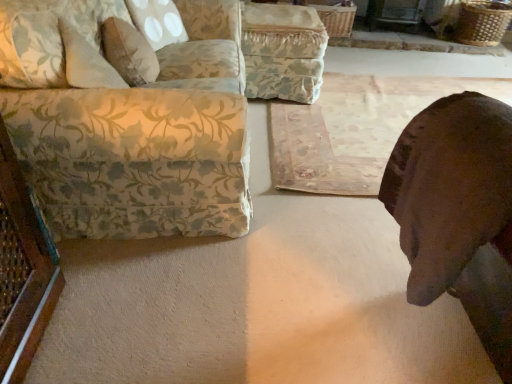
Question: Is brown leather dog at lower right shorter than fluffy beige pillow at upper left?

Choices:
 (A) no
 (B) yes

Answer: (A)

Question: Is brown leather dog at lower right not near fluffy beige pillow at upper left?

Choices:
 (A) no
 (B) yes

Answer: (B)

Question: Does brown leather dog at lower right have a lesser width compared to fluffy beige pillow at upper left?

Choices:
 (A) no
 (B) yes

Answer: (A)

Question: Does brown leather dog at lower right have a larger size compared to fluffy beige pillow at upper left?

Choices:
 (A) no
 (B) yes

Answer: (B)

Question: Is brown leather dog at lower right facing away from fluffy beige pillow at upper left?

Choices:
 (A) yes
 (B) no

Answer: (B)

Question: Is brown leather dog at lower right smaller than fluffy beige pillow at upper left?

Choices:
 (A) no
 (B) yes

Answer: (A)

Question: Would you say fluffy beige pillow at upper left is part of floral fabric couch at left's contents?

Choices:
 (A) no
 (B) yes

Answer: (B)

Question: Considering the relative sizes of floral fabric couch at left and fluffy beige pillow at upper left in the image provided, is floral fabric couch at left bigger than fluffy beige pillow at upper left?

Choices:
 (A) yes
 (B) no

Answer: (A)

Question: Could you tell me if floral fabric couch at left is facing fluffy beige pillow at upper left?

Choices:
 (A) yes
 (B) no

Answer: (A)

Question: Does floral fabric couch at left lie behind fluffy beige pillow at upper left?

Choices:
 (A) no
 (B) yes

Answer: (A)

Question: Is floral fabric couch at left to the left of fluffy beige pillow at upper left from the viewer's perspective?

Choices:
 (A) yes
 (B) no

Answer: (B)

Question: From the image's perspective, is floral fabric couch at left on top of fluffy beige pillow at upper left?

Choices:
 (A) no
 (B) yes

Answer: (A)

Question: Is rustic wooden mat at center to the right of floral fabric couch at left from the viewer's perspective?

Choices:
 (A) yes
 (B) no

Answer: (A)